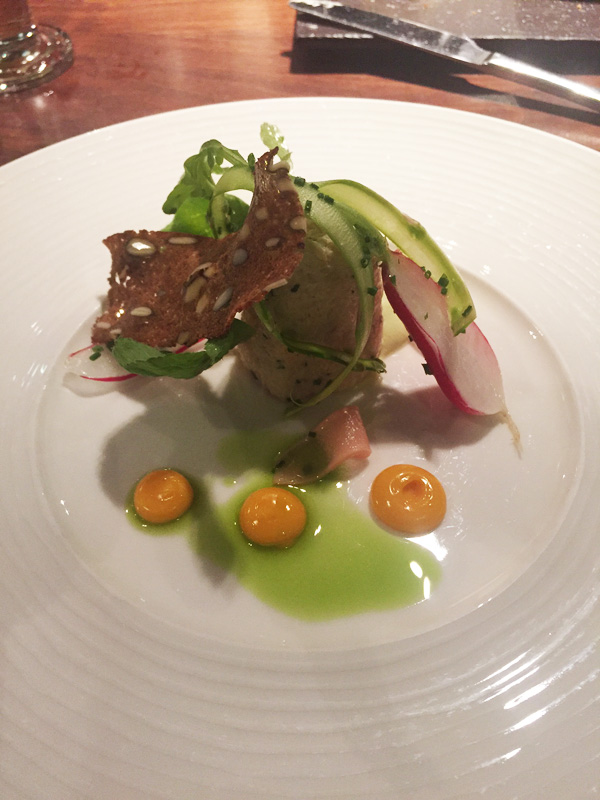
Find the location of a particular element. The width and height of the screenshot is (600, 800). silverware is located at coordinates (506, 70).